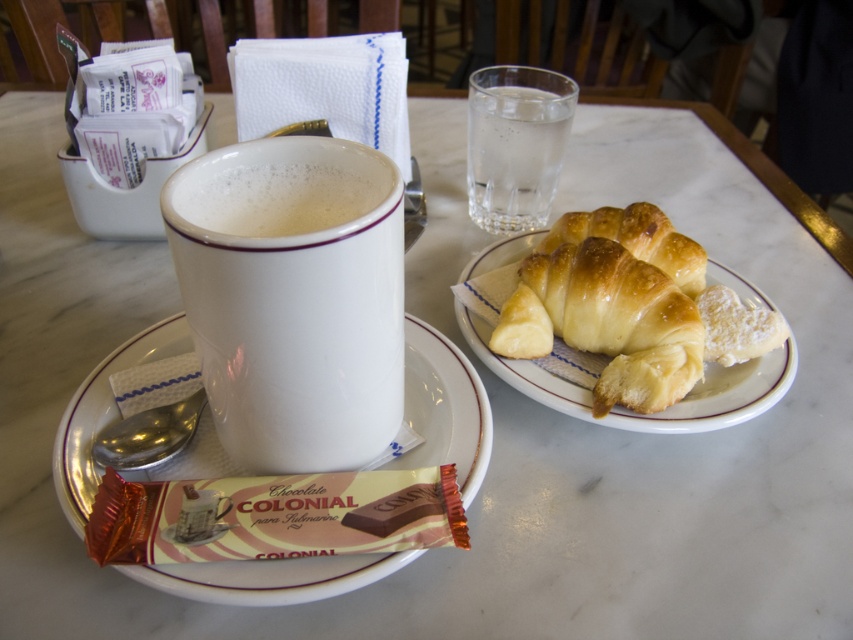
Is golden-brown flaky croissant at center-right to the right of white matte mug at upper center from the viewer's perspective?

Correct, you'll find golden-brown flaky croissant at center-right to the right of white matte mug at upper center.

Find the location of a particular element. The image size is (853, 640). golden-brown flaky croissant at center-right is located at coordinates (653, 412).

Who is more distant from viewer, (247, 216) or (496, 93)?

Point (496, 93)

Does point (334, 140) come in front of point (543, 140)?

Yes, point (334, 140) is closer to viewer.

The width and height of the screenshot is (853, 640). What do you see at coordinates (293, 296) in the screenshot? I see `white glossy mug at center` at bounding box center [293, 296].

Where is `white glossy mug at center`? white glossy mug at center is located at coordinates (293, 296).

Between white ceramic saucer at lower left and white matte mug at upper center, which one has more height?

Standing taller between the two is white ceramic saucer at lower left.

Which is behind, point (293, 596) or point (277, 225)?

The point (277, 225) is more distant.

The image size is (853, 640). What are the coordinates of `white ceramic saucer at lower left` in the screenshot? It's located at [444, 406].

Image resolution: width=853 pixels, height=640 pixels. What are the coordinates of `white ceramic saucer at lower left` in the screenshot? It's located at (444, 406).